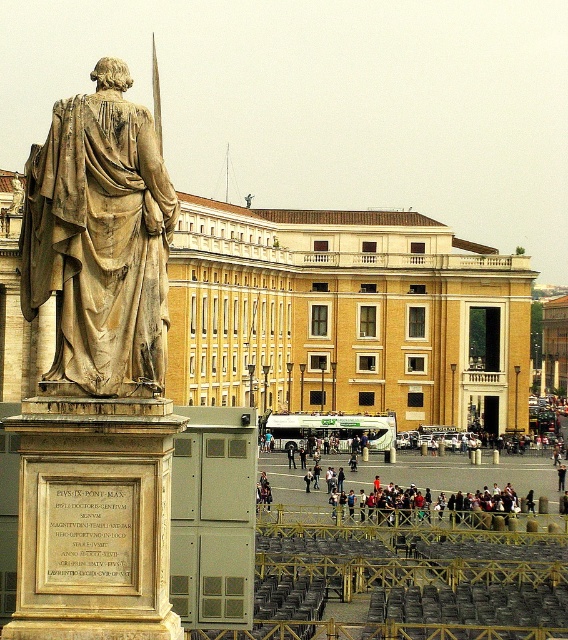
Based on the photo, does beige stone building at center have a smaller size compared to stone statue at upper left?

Indeed, beige stone building at center has a smaller size compared to stone statue at upper left.

Who is more forward, (419, 230) or (119, 216)?

Answer: Point (119, 216) is more forward.

Image resolution: width=568 pixels, height=640 pixels. What are the coordinates of `beige stone building at center` in the screenshot? It's located at (346, 316).

Can you confirm if beige stone building at center is taller than dark gray fabric jacket at center?

Yes.

Find the location of a particular element. The height and width of the screenshot is (640, 568). beige stone building at center is located at coordinates (346, 316).

Describe the element at coordinates (346, 316) in the screenshot. This screenshot has width=568, height=640. I see `beige stone building at center` at that location.

The image size is (568, 640). I want to click on beige stone building at center, so click(346, 316).

Can you confirm if stone statue at upper left is wider than dark gray fabric jacket at center?

Indeed, stone statue at upper left has a greater width compared to dark gray fabric jacket at center.

Which is behind, point (83, 276) or point (452, 512)?

Point (452, 512)

Where is `stone statue at upper left`? This screenshot has height=640, width=568. stone statue at upper left is located at coordinates (101, 237).